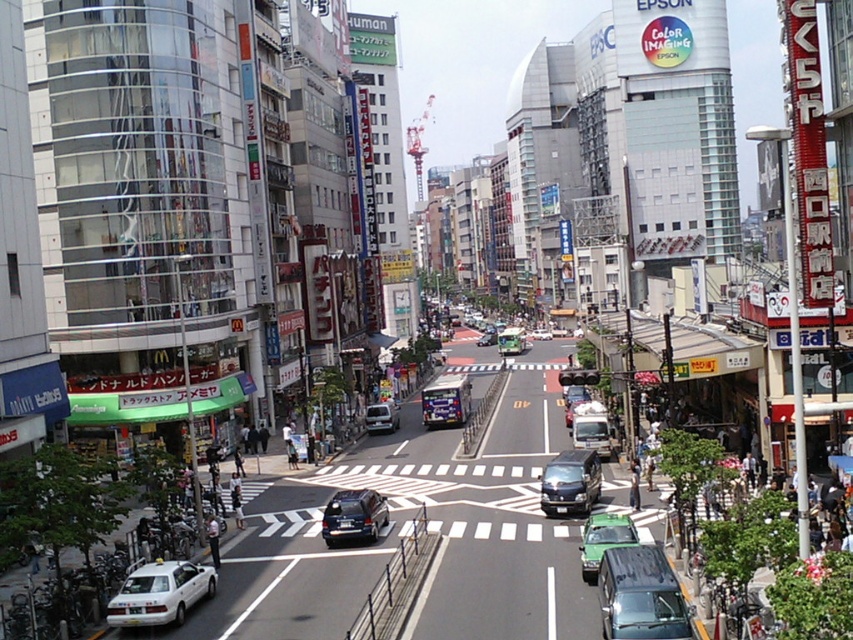
Who is shorter, green matte van at center or shiny black van at center?

green matte van at center is shorter.

Does green matte van at center have a greater width compared to shiny black van at center?

Incorrect, green matte van at center's width does not surpass shiny black van at center's.

Is point (596, 582) closer to viewer compared to point (587, 506)?

Yes, it is in front of point (587, 506).

This screenshot has width=853, height=640. I want to click on green matte van at center, so click(x=641, y=595).

Where is `shiny black van at center`? Image resolution: width=853 pixels, height=640 pixels. shiny black van at center is located at coordinates (570, 483).

Image resolution: width=853 pixels, height=640 pixels. Describe the element at coordinates (570, 483) in the screenshot. I see `shiny black van at center` at that location.

I want to click on shiny black van at center, so click(570, 483).

Does shiny black sedan at center appear under matte silver van at center?

Indeed, shiny black sedan at center is positioned under matte silver van at center.

Does point (378, 536) come behind point (386, 428)?

No, it is in front of (386, 428).

Where is `shiny black sedan at center`? shiny black sedan at center is located at coordinates (352, 516).